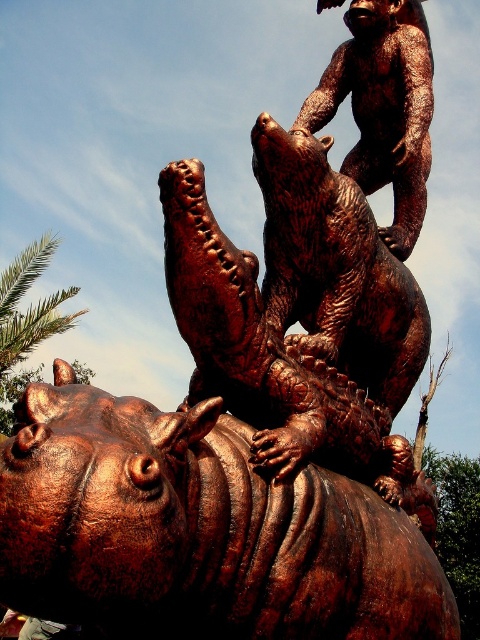
Question: Can you confirm if bronze textured hippo at center is positioned above bronze bear at upper center?

Choices:
 (A) no
 (B) yes

Answer: (A)

Question: Does bronze textured hippo at center have a lesser width compared to bronze bear at upper center?

Choices:
 (A) no
 (B) yes

Answer: (A)

Question: Which of these objects is positioned farthest from the bronze textured hippo at center?

Choices:
 (A) bronze textured bear at center
 (B) bronze bear at upper center

Answer: (B)

Question: Does bronze textured hippo at center have a lesser width compared to bronze bear at upper center?

Choices:
 (A) no
 (B) yes

Answer: (A)

Question: Which point is farther to the camera?

Choices:
 (A) (392, 406)
 (B) (240, 484)

Answer: (A)

Question: Which object is positioned farthest from the bronze textured bear at center?

Choices:
 (A) bronze textured hippo at center
 (B) bronze bear at upper center

Answer: (A)